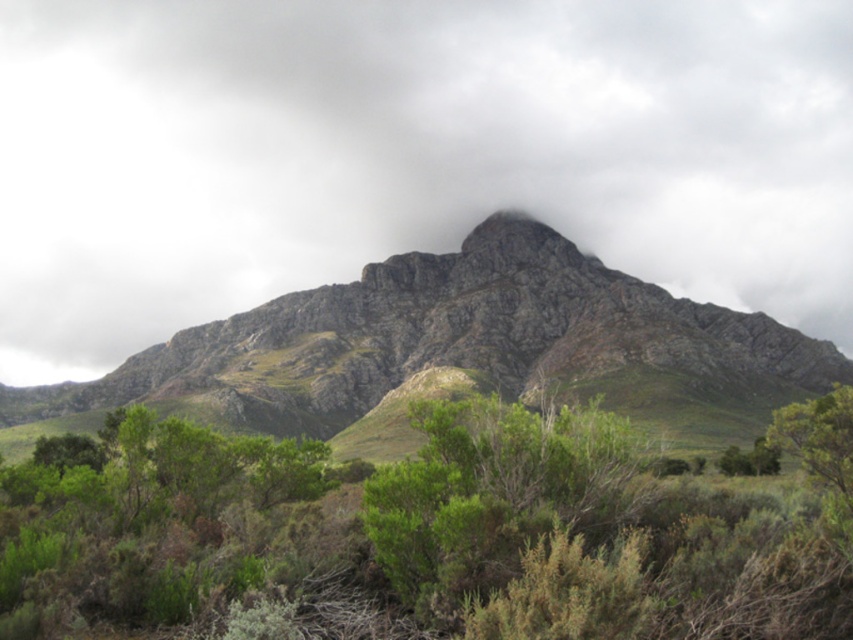
You are planning to set up a small campsite in this mountain area. You have a tent that requires a flat area wider than the green leafy shrub at center. Can you determine if the rugged rock mountain at center provides enough width for your tent?

The rugged rock mountain at center might be wider than green leafy shrub at center. If the mountain is indeed wider, then the area might be suitable for your tent. However, since the exact width isn

You are a hiker standing at the base of the mountain. You see two points marked on the mountain slope. The first point is at coordinates point (389, 260) and the second point is at point (625, 438). Which point is closer to you?

Point (389, 260) is further to the camera than point (625, 438). Therefore, point (625, 438) is closer to you.

You are a hiker planning to take a photo of the rugged rock mountain at center and the white fluffy cloud at center. Since you want both in the frame, which object should you position closer to the left side of your camera?

You should position the white fluffy cloud at center closer to the left side of your camera because it is already located to the left of the rugged rock mountain at center.